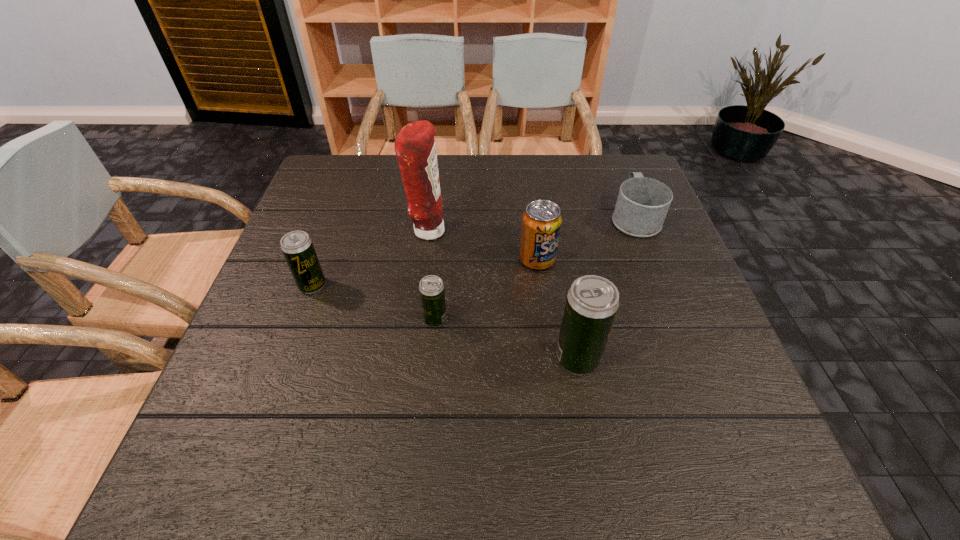
Identify the location of vacant place for an extra beer can on the right. This screenshot has width=960, height=540. (743, 404).